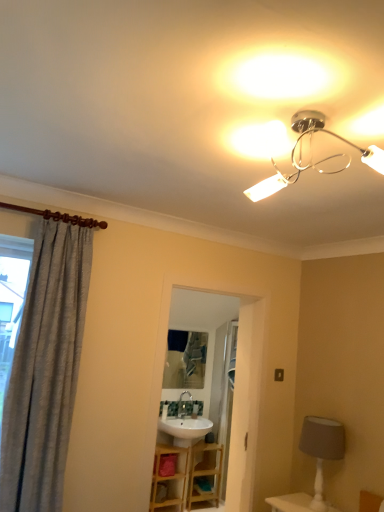
Question: Is gray textured curtain at left not close to wooden vanity at center?

Choices:
 (A) no
 (B) yes

Answer: (B)

Question: Is gray textured curtain at left shorter than wooden vanity at center?

Choices:
 (A) no
 (B) yes

Answer: (A)

Question: Does gray textured curtain at left have a larger size compared to wooden vanity at center?

Choices:
 (A) no
 (B) yes

Answer: (B)

Question: Is gray textured curtain at left further to camera compared to wooden vanity at center?

Choices:
 (A) yes
 (B) no

Answer: (B)

Question: Would you say gray textured curtain at left contains wooden vanity at center?

Choices:
 (A) no
 (B) yes

Answer: (A)

Question: In terms of height, does gray textured curtain at left look taller or shorter compared to wooden vanity at center?

Choices:
 (A) short
 (B) tall

Answer: (B)

Question: Is gray textured curtain at left bigger or smaller than wooden vanity at center?

Choices:
 (A) big
 (B) small

Answer: (A)

Question: In the image, is gray textured curtain at left positioned in front of or behind wooden vanity at center?

Choices:
 (A) front
 (B) behind

Answer: (A)

Question: Considering the positions of gray textured curtain at left and wooden vanity at center in the image, is gray textured curtain at left wider or thinner than wooden vanity at center?

Choices:
 (A) wide
 (B) thin

Answer: (B)

Question: Choose the correct answer: Is wooden vanity at center inside metallic reflective mirror at center or outside it?

Choices:
 (A) inside
 (B) outside

Answer: (B)

Question: In terms of height, does wooden vanity at center look taller or shorter compared to metallic reflective mirror at center?

Choices:
 (A) tall
 (B) short

Answer: (B)

Question: In the image, is wooden vanity at center positioned in front of or behind metallic reflective mirror at center?

Choices:
 (A) behind
 (B) front

Answer: (B)

Question: Visually, is wooden vanity at center positioned to the left or to the right of metallic reflective mirror at center?

Choices:
 (A) right
 (B) left

Answer: (A)

Question: Is white textured table lamp at lower right inside or outside of metallic reflective mirror at center?

Choices:
 (A) inside
 (B) outside

Answer: (B)

Question: Considering their positions, is white textured table lamp at lower right located in front of or behind metallic reflective mirror at center?

Choices:
 (A) behind
 (B) front

Answer: (B)